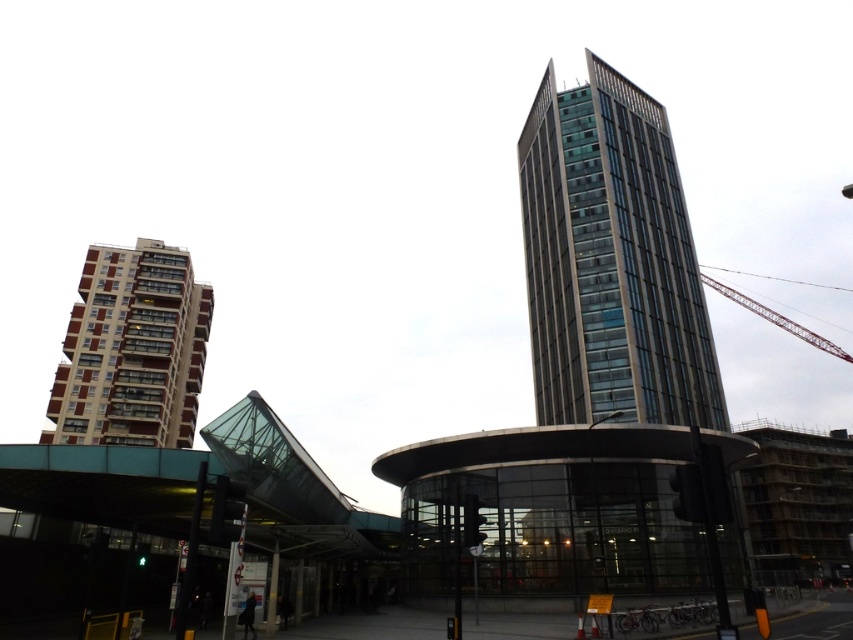
Question: Is beige concrete building at lower left to the right of metallic red crane at upper right from the viewer's perspective?

Choices:
 (A) yes
 (B) no

Answer: (B)

Question: Does glassy steel tower at upper right have a smaller size compared to metallic red crane at upper right?

Choices:
 (A) no
 (B) yes

Answer: (B)

Question: Which point is farther to the camera?

Choices:
 (A) glassy steel tower at upper right
 (B) metallic red crane at upper right
 (C) beige concrete building at lower left

Answer: (C)

Question: Among these objects, which one is farthest from the camera?

Choices:
 (A) metallic red crane at upper right
 (B) glassy steel tower at upper right
 (C) beige concrete building at lower left

Answer: (C)

Question: Can you confirm if glassy steel tower at upper right is bigger than metallic red crane at upper right?

Choices:
 (A) yes
 (B) no

Answer: (B)

Question: Which object appears closest to the camera in this image?

Choices:
 (A) metallic red crane at upper right
 (B) beige concrete building at lower left

Answer: (A)